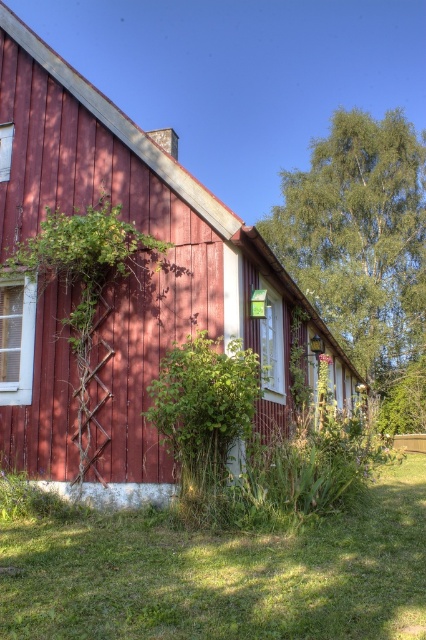
Between point (229, 552) and point (383, 300), which one is positioned behind?

The point (383, 300) is behind.

Between point (175, 632) and point (423, 141), which one is positioned behind?

Positioned behind is point (423, 141).

Where is `green grass at lower center`? green grass at lower center is located at coordinates (224, 573).

Between wooden hut at center and green leafy bush at lower center, which one appears on the right side from the viewer's perspective?

wooden hut at center is more to the right.

Is wooden hut at center positioned behind green leafy bush at lower center?

Yes.

At what (x,y) coordinates should I click in order to perform the action: click on wooden hut at center. Please return your answer as a coordinate pair (x, y). Looking at the image, I should click on (157, 273).

Identify the location of wooden hut at center. This screenshot has width=426, height=640. (157, 273).

Is point (339, 301) behind point (28, 273)?

That is True.

Is green leafy tree at upper right taller than green leafy plant at left?

Yes, green leafy tree at upper right is taller than green leafy plant at left.

Which is behind, point (363, 128) or point (19, 262)?

The point (363, 128) is behind.

This screenshot has width=426, height=640. Identify the location of green leafy tree at upper right. (362, 243).